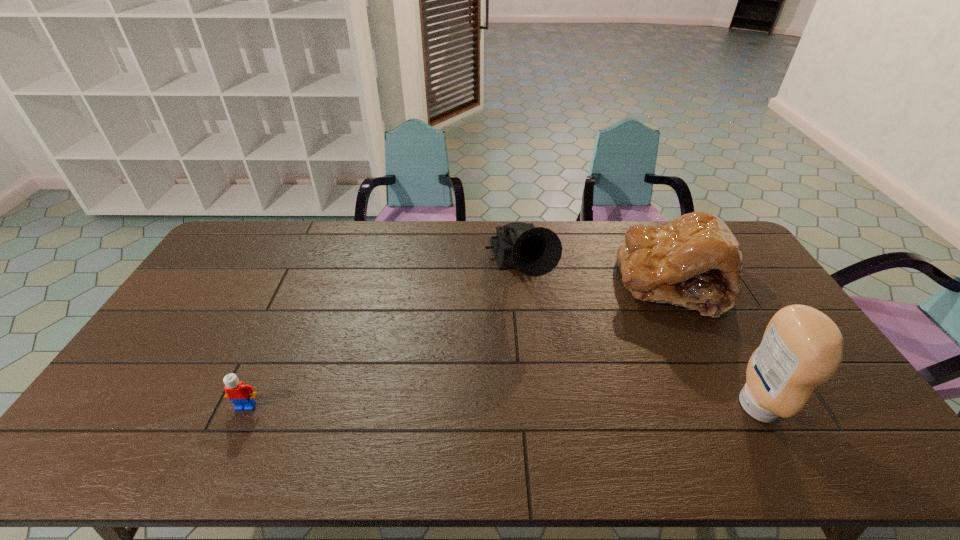
The height and width of the screenshot is (540, 960). Identify the location of vacant space situated on the filling side of the second shortest object. (561, 383).

Locate an element on the screen. The height and width of the screenshot is (540, 960). vacant space positioned 0.290m on the filling side of the second shortest object is located at coordinates (585, 360).

The width and height of the screenshot is (960, 540). Identify the location of free space located on the filling side of the second shortest object. (588, 359).

The width and height of the screenshot is (960, 540). What are the coordinates of `phonograph_record that is at the far edge` in the screenshot? It's located at (535, 251).

At what (x,y) coordinates should I click in order to perform the action: click on bread that is at the far edge. Please return your answer as a coordinate pair (x, y). The width and height of the screenshot is (960, 540). Looking at the image, I should click on (695, 261).

Where is `Lego at the near edge`? This screenshot has height=540, width=960. Lego at the near edge is located at coordinates (242, 395).

Where is `condiment located in the near edge section of the desktop`? The width and height of the screenshot is (960, 540). condiment located in the near edge section of the desktop is located at coordinates (802, 348).

Where is `object located in the right edge section of the desktop`? This screenshot has width=960, height=540. object located in the right edge section of the desktop is located at coordinates (695, 261).

Locate an element on the screen. This screenshot has width=960, height=540. object located at the far right corner is located at coordinates (695, 261).

This screenshot has height=540, width=960. Find the location of `vacant space at the far edge`. vacant space at the far edge is located at coordinates (329, 236).